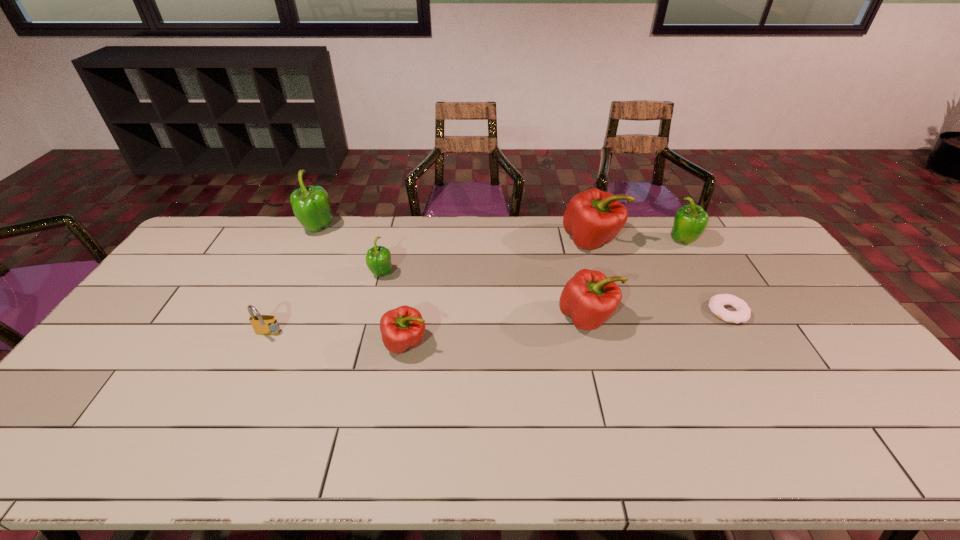
You are a GUI agent. You are given a task and a screenshot of the screen. Output one action in this format:
    pyautogui.click(x=<x>, y=<y>)
    Task: Click on the empty space that is in between the doughnut and the padlock
    
    Given the screenshot: What is the action you would take?
    pyautogui.click(x=497, y=323)

Identify the location of blank region between the biggest pink bell pepper and the smallest green bell pepper. The width and height of the screenshot is (960, 540). (487, 258).

In order to click on vacant space that is in between the doughnut and the padlock in this screenshot , I will do `click(497, 323)`.

Locate an element on the screen. the seventh closest object to the leftmost bell pepper is located at coordinates (716, 304).

The width and height of the screenshot is (960, 540). Identify the location of object that is the seventh closest to the padlock. (690, 221).

Select which bell pepper appears as the closest to the shortest object. Please provide its 2D coordinates. Your answer should be formatted as a tuple, i.e. [(x, y)], where the tuple contains the x and y coordinates of a point satisfying the conditions above.

[(690, 221)]

Locate which bell pepper ranks third in proximity to the second smallest pink bell pepper. Please provide its 2D coordinates. Your answer should be formatted as a tuple, i.e. [(x, y)], where the tuple contains the x and y coordinates of a point satisfying the conditions above.

[(402, 328)]

The image size is (960, 540). I want to click on green bell pepper that is the nearest to the rightmost bell pepper, so click(x=378, y=259).

This screenshot has height=540, width=960. I want to click on the second closest green bell pepper relative to the biggest green bell pepper, so click(x=690, y=221).

Identify the location of pink bell pepper that is the second closest to the biggest pink bell pepper. Image resolution: width=960 pixels, height=540 pixels. (402, 328).